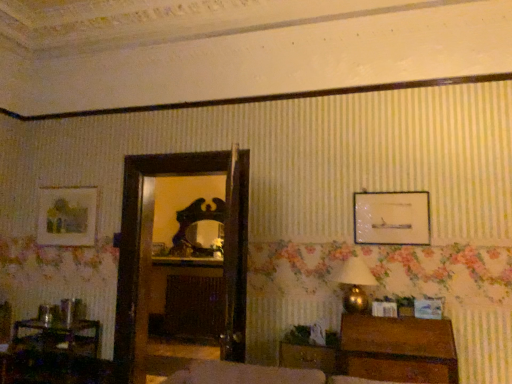
This screenshot has width=512, height=384. In order to click on free spot above matte wooden picture frame at upper left, which is counted as the second picture frame, starting from the bottom (from a real-world perspective) in this screenshot , I will do `click(72, 181)`.